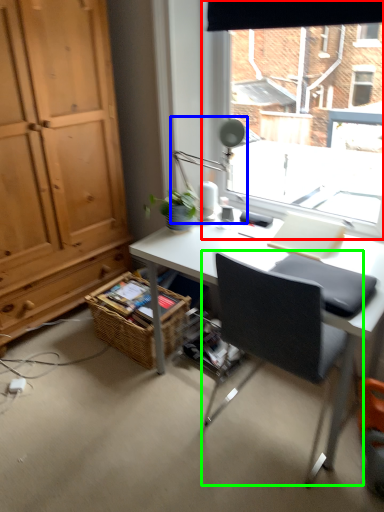
Question: Estimate the real-world distances between objects in this image. Which object is farther from window (highlighted by a red box), table lamp (highlighted by a blue box) or chair (highlighted by a green box)?

Choices:
 (A) table lamp
 (B) chair

Answer: (B)